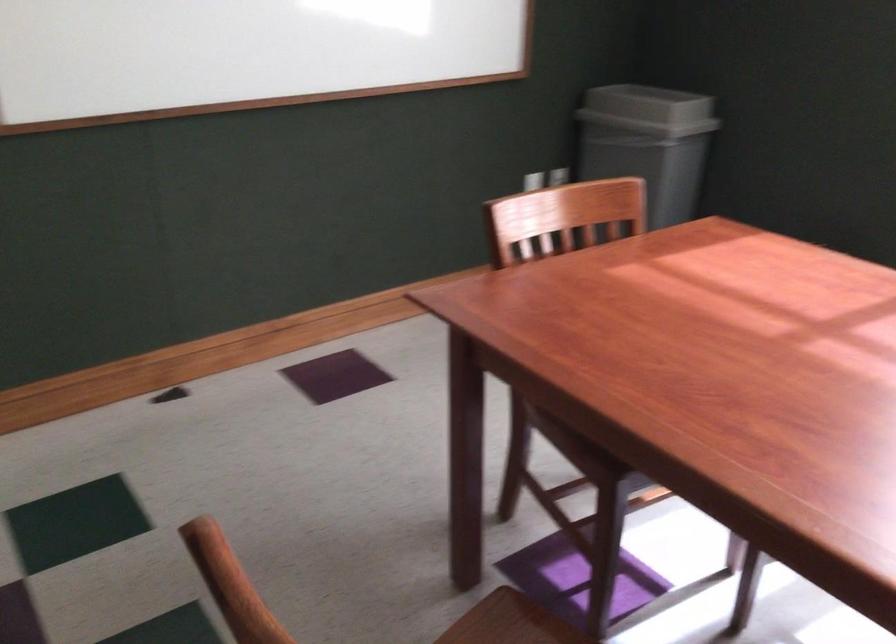
Where is `chair sitting surface`? The width and height of the screenshot is (896, 644). chair sitting surface is located at coordinates (570, 453).